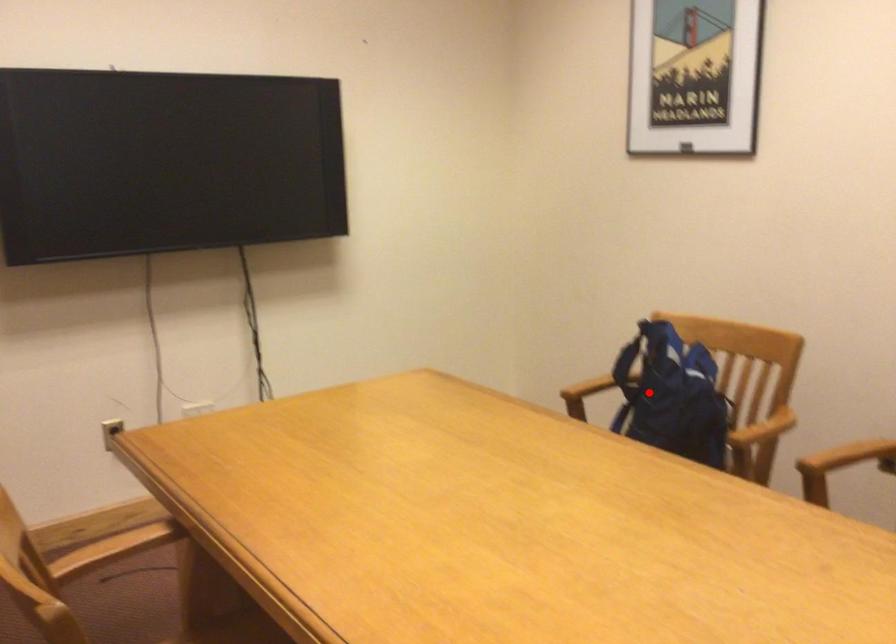
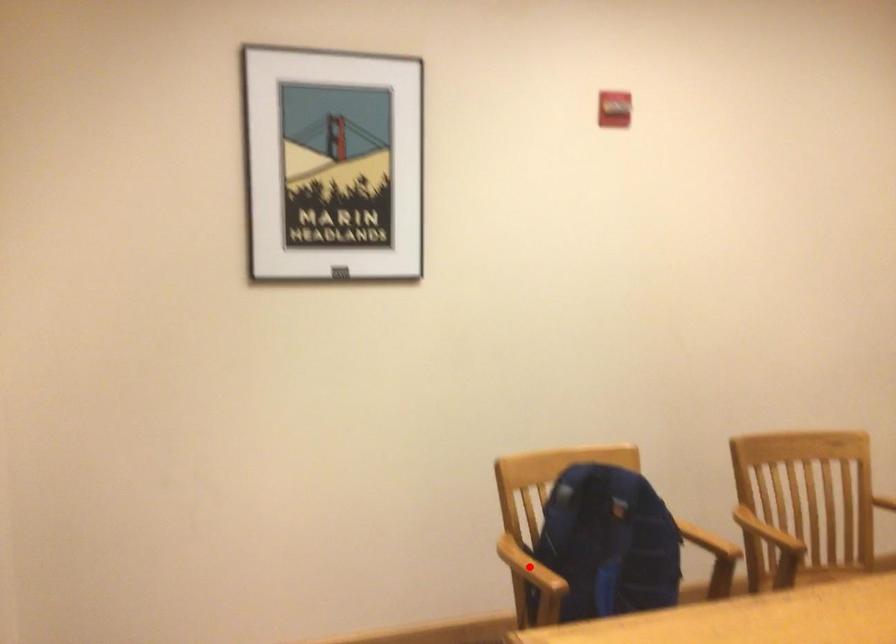
I am providing you with two images of the same scene from different viewpoints. A red point is marked on the first image and another point is marked on the second image. Are the points marked in image1 and image2 representing the same 3D position?

No